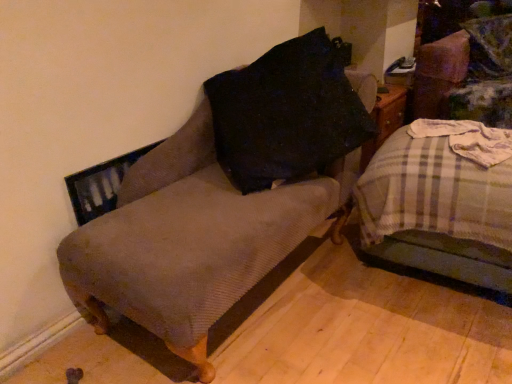
Question: From the image's perspective, would you say plaid fabric bed at right is shown under textured brown armchair at left?

Choices:
 (A) yes
 (B) no

Answer: (A)

Question: Is plaid fabric bed at right to the left of textured brown armchair at left from the viewer's perspective?

Choices:
 (A) no
 (B) yes

Answer: (A)

Question: Can you confirm if plaid fabric bed at right is shorter than textured brown armchair at left?

Choices:
 (A) no
 (B) yes

Answer: (B)

Question: Is plaid fabric bed at right further to camera compared to textured brown armchair at left?

Choices:
 (A) no
 (B) yes

Answer: (B)

Question: Could textured brown armchair at left be considered to be inside plaid fabric bed at right?

Choices:
 (A) yes
 (B) no

Answer: (B)

Question: From a real-world perspective, relative to plaid fabric bed at right, is velvet green swivel chair at upper right vertically above or below?

Choices:
 (A) below
 (B) above

Answer: (B)

Question: From the image's perspective, is velvet green swivel chair at upper right positioned above or below plaid fabric bed at right?

Choices:
 (A) below
 (B) above

Answer: (B)

Question: Considering the relative positions of velvet green swivel chair at upper right and plaid fabric bed at right in the image provided, is velvet green swivel chair at upper right to the left or to the right of plaid fabric bed at right?

Choices:
 (A) right
 (B) left

Answer: (A)

Question: Relative to plaid fabric bed at right, is velvet green swivel chair at upper right in front or behind?

Choices:
 (A) front
 (B) behind

Answer: (B)

Question: Is point (143, 309) closer or farther from the camera than point (453, 76)?

Choices:
 (A) farther
 (B) closer

Answer: (B)

Question: Based on their sizes in the image, would you say textured brown armchair at left is bigger or smaller than velvet green swivel chair at upper right?

Choices:
 (A) small
 (B) big

Answer: (B)

Question: Would you say textured brown armchair at left is inside or outside velvet green swivel chair at upper right?

Choices:
 (A) inside
 (B) outside

Answer: (B)

Question: From the image's perspective, is textured brown armchair at left above or below velvet green swivel chair at upper right?

Choices:
 (A) above
 (B) below

Answer: (B)

Question: Based on their positions, is velvet green swivel chair at upper right located to the left or right of textured brown armchair at left?

Choices:
 (A) left
 (B) right

Answer: (B)

Question: From the image's perspective, is velvet green swivel chair at upper right above or below textured brown armchair at left?

Choices:
 (A) below
 (B) above

Answer: (B)